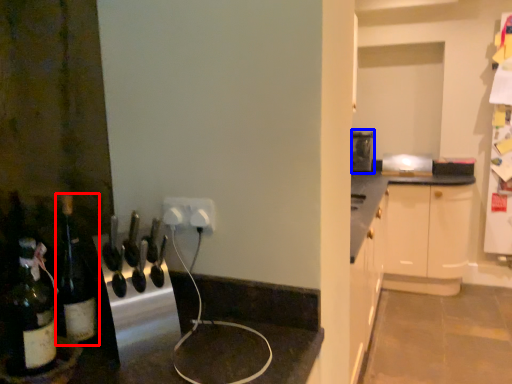
Question: Which of the following is the farthest to the observer, bottle (highlighted by a red box) or appliance (highlighted by a blue box)?

Choices:
 (A) bottle
 (B) appliance

Answer: (B)